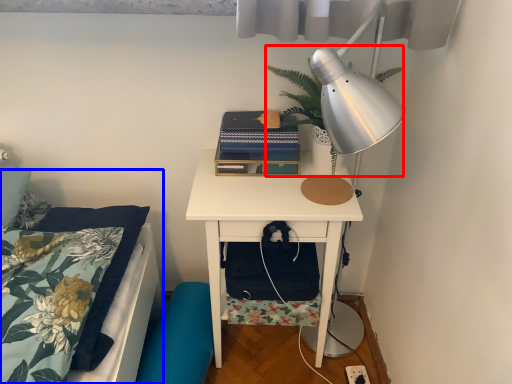
Question: Which object is further to the camera taking this photo, plant (highlighted by a red box) or bed (highlighted by a blue box)?

Choices:
 (A) plant
 (B) bed

Answer: (A)